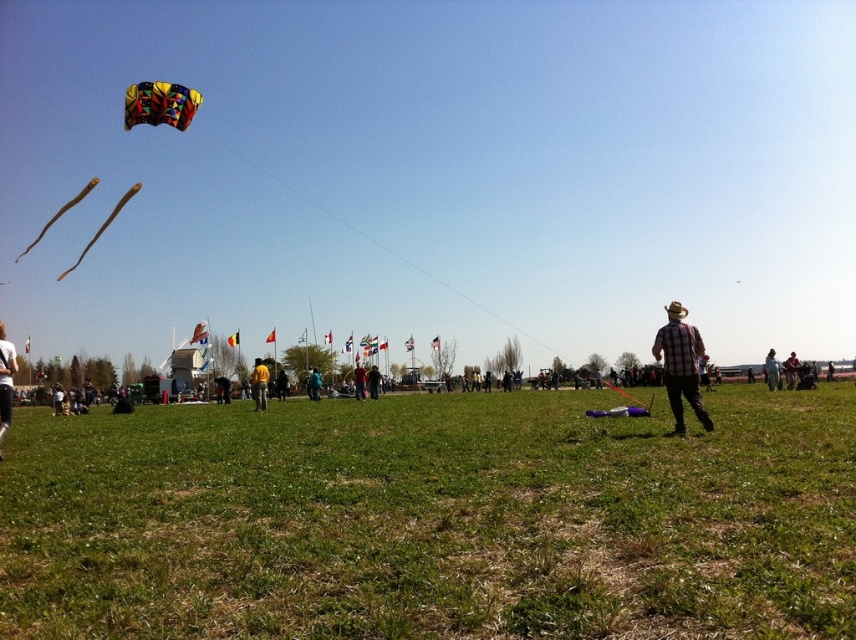
Does green grassy field at center have a larger size compared to multicolored fabric kite at upper left?

Actually, green grassy field at center might be smaller than multicolored fabric kite at upper left.

Is green grassy field at center taller than multicolored fabric kite at upper left?

Incorrect, green grassy field at center's height is not larger of multicolored fabric kite at upper left's.

Identify the location of green grassy field at center. (432, 518).

This screenshot has height=640, width=856. I want to click on green grassy field at center, so click(x=432, y=518).

Does plaid fabric shirt at right appear on the right side of white cotton shirt at lower left?

Indeed, plaid fabric shirt at right is positioned on the right side of white cotton shirt at lower left.

Does plaid fabric shirt at right appear under white cotton shirt at lower left?

No.

Is point (693, 404) less distant than point (6, 356)?

No, it is behind (6, 356).

At what (x,y) coordinates should I click in order to perform the action: click on plaid fabric shirt at right. Please return your answer as a coordinate pair (x, y). The image size is (856, 640). Looking at the image, I should click on (681, 365).

Is point (524, 556) more distant than point (265, 374)?

No, it is in front of (265, 374).

I want to click on green grassy field at center, so click(432, 518).